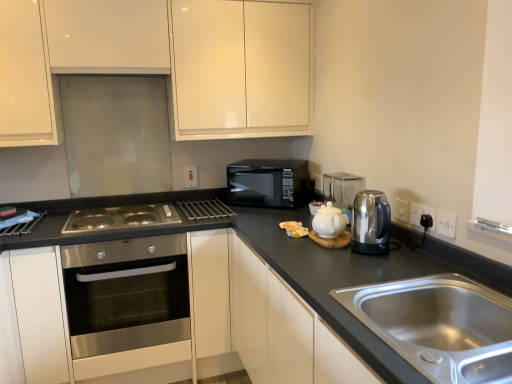
Find the location of a particular element. This screenshot has height=384, width=512. blank space to the left of satin metallic kettle at right, arranged as the 3th appliance when viewed from the left is located at coordinates (329, 261).